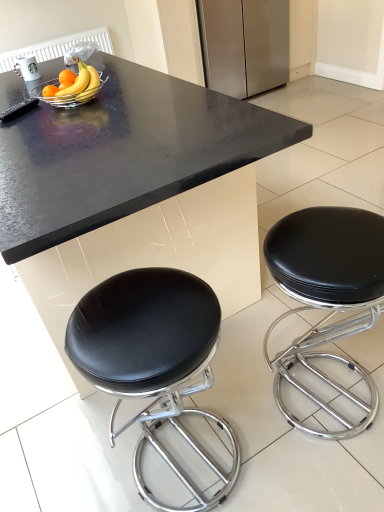
Question: Are stainless steel refrigerator at upper center and black leather stool at lower right, acting as the first stool starting from the right, beside each other?

Choices:
 (A) yes
 (B) no

Answer: (B)

Question: Does stainless steel refrigerator at upper center have a larger size compared to black leather stool at lower right, acting as the first stool starting from the right?

Choices:
 (A) yes
 (B) no

Answer: (A)

Question: Is stainless steel refrigerator at upper center further to camera compared to black leather stool at lower right, acting as the first stool starting from the right?

Choices:
 (A) no
 (B) yes

Answer: (B)

Question: Can you confirm if stainless steel refrigerator at upper center is wider than black leather stool at lower right, acting as the first stool starting from the right?

Choices:
 (A) yes
 (B) no

Answer: (A)

Question: Is stainless steel refrigerator at upper center located outside black leather stool at lower right, the 2th stool in the left-to-right sequence?

Choices:
 (A) yes
 (B) no

Answer: (A)

Question: Is stainless steel refrigerator at upper center thinner than black leather stool at lower right, acting as the first stool starting from the right?

Choices:
 (A) yes
 (B) no

Answer: (B)

Question: Does black granite table at center touch yellow matte bananas at upper left, placed as the 1th banana when sorted from front to back?

Choices:
 (A) no
 (B) yes

Answer: (A)

Question: Considering the relative sizes of black granite table at center and yellow matte bananas at upper left, the 2th banana when ordered from back to front, in the image provided, is black granite table at center wider than yellow matte bananas at upper left, the 2th banana when ordered from back to front,?

Choices:
 (A) no
 (B) yes

Answer: (B)

Question: From the image's perspective, is black granite table at center on top of yellow matte bananas at upper left, placed as the 1th banana when sorted from front to back?

Choices:
 (A) yes
 (B) no

Answer: (B)

Question: From a real-world perspective, is black granite table at center beneath yellow matte bananas at upper left, the 2th banana when ordered from back to front?

Choices:
 (A) yes
 (B) no

Answer: (A)

Question: Does black granite table at center turn towards yellow matte bananas at upper left, the 2th banana when ordered from back to front?

Choices:
 (A) no
 (B) yes

Answer: (A)

Question: Is black granite table at center positioned beyond the bounds of yellow matte bananas at upper left, placed as the 1th banana when sorted from front to back?

Choices:
 (A) yes
 (B) no

Answer: (A)

Question: Is the depth of black granite table at center less than that of metallic silver bowl at upper center?

Choices:
 (A) no
 (B) yes

Answer: (B)